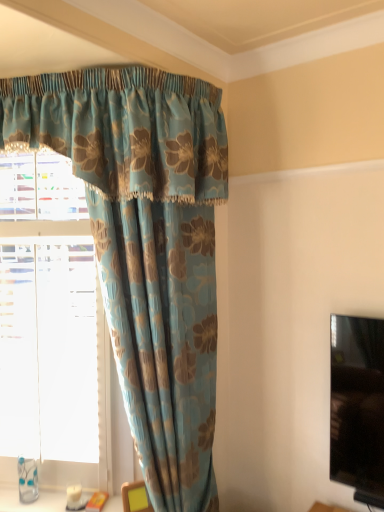
This screenshot has width=384, height=512. What do you see at coordinates (48, 349) in the screenshot? I see `blue floral curtain at upper left` at bounding box center [48, 349].

The height and width of the screenshot is (512, 384). What do you see at coordinates (135, 497) in the screenshot?
I see `yellow fabric at lower center` at bounding box center [135, 497].

Identify the location of blue floral curtain at upper left. This screenshot has width=384, height=512. (48, 349).

From the image's perspective, relative to blue floral curtain at upper left, is blue floral fabric curtain at upper left above or below?

blue floral fabric curtain at upper left is below blue floral curtain at upper left.

Which is behind, point (171, 301) or point (76, 190)?

The point (76, 190) is farther.

Are blue floral fabric curtain at upper left and blue floral curtain at upper left making contact?

No, blue floral fabric curtain at upper left is not making contact with blue floral curtain at upper left.

At what (x,y) coordinates should I click in order to perform the action: click on curtain on the right of the blue floral curtain at upper left. Please return your answer as a coordinate pair (x, y). The image size is (384, 512). Looking at the image, I should click on (146, 245).

Is blue floral fabric curtain at upper left to the left or to the right of yellow fabric at lower center in the image?

In the image, blue floral fabric curtain at upper left appears on the right side of yellow fabric at lower center.

Considering the sizes of objects blue floral fabric curtain at upper left and yellow fabric at lower center in the image provided, who is smaller, blue floral fabric curtain at upper left or yellow fabric at lower center?

yellow fabric at lower center.

Could you tell me if blue floral fabric curtain at upper left is turned towards yellow fabric at lower center?

Yes, blue floral fabric curtain at upper left is turned towards yellow fabric at lower center.

Which of these two, blue floral fabric curtain at upper left or yellow fabric at lower center, is wider?

blue floral fabric curtain at upper left.

From a real-world perspective, is blue floral curtain at upper left positioned under blue floral fabric curtain at upper left based on gravity?

No, from a real-world perspective, blue floral curtain at upper left is not under blue floral fabric curtain at upper left.

From the image's perspective, would you say blue floral curtain at upper left is shown under blue floral fabric curtain at upper left?

No, from the image's perspective, blue floral curtain at upper left is not beneath blue floral fabric curtain at upper left.

In terms of width, does blue floral curtain at upper left look wider or thinner when compared to blue floral fabric curtain at upper left?

Clearly, blue floral curtain at upper left has more width compared to blue floral fabric curtain at upper left.

Considering the relative positions of blue floral curtain at upper left and blue floral fabric curtain at upper left in the image provided, is blue floral curtain at upper left to the right of blue floral fabric curtain at upper left from the viewer's perspective?

Incorrect, blue floral curtain at upper left is not on the right side of blue floral fabric curtain at upper left.

Does yellow fabric at lower center have a lesser width compared to blue floral fabric curtain at upper left?

Indeed, yellow fabric at lower center has a lesser width compared to blue floral fabric curtain at upper left.

From a real-world perspective, relative to blue floral fabric curtain at upper left, is yellow fabric at lower center vertically above or below?

From a real-world perspective, yellow fabric at lower center is physically below blue floral fabric curtain at upper left.

Is yellow fabric at lower center to the right of blue floral fabric curtain at upper left from the viewer's perspective?

Incorrect, yellow fabric at lower center is not on the right side of blue floral fabric curtain at upper left.

What's the angular difference between yellow fabric at lower center and blue floral fabric curtain at upper left's facing directions?

yellow fabric at lower center and blue floral fabric curtain at upper left are facing 34.6 degrees away from each other.

Is the depth of yellow fabric at lower center greater than that of blue floral curtain at upper left?

That is True.

Is yellow fabric at lower center at the left side of blue floral curtain at upper left?

No, yellow fabric at lower center is not to the left of blue floral curtain at upper left.

Can you tell me how much yellow fabric at lower center and blue floral curtain at upper left differ in facing direction?

The angular difference between yellow fabric at lower center and blue floral curtain at upper left is 24.3 degrees.

Is yellow fabric at lower center at the back of blue floral curtain at upper left?

blue floral curtain at upper left is not turned away from yellow fabric at lower center.

Where is `furniture behind the blue floral curtain at upper left`? The width and height of the screenshot is (384, 512). furniture behind the blue floral curtain at upper left is located at coordinates (135, 497).

Is blue floral curtain at upper left wider than yellow fabric at lower center?

Indeed, blue floral curtain at upper left has a greater width compared to yellow fabric at lower center.

Locate an element on the screen. The height and width of the screenshot is (512, 384). bay window behind the blue floral fabric curtain at upper left is located at coordinates (48, 349).

This screenshot has width=384, height=512. In order to click on curtain in front of the yellow fabric at lower center in this screenshot , I will do [x=146, y=245].

Looking at the image, which one is located further to blue floral fabric curtain at upper left, blue floral curtain at upper left or yellow fabric at lower center?

yellow fabric at lower center.

When comparing their distances from yellow fabric at lower center, does blue floral curtain at upper left or blue floral fabric curtain at upper left seem further?

blue floral fabric curtain at upper left is further to yellow fabric at lower center.

Estimate the real-world distances between objects in this image. Which object is closer to blue floral fabric curtain at upper left, yellow fabric at lower center or blue floral curtain at upper left?

blue floral curtain at upper left is positioned closer to the anchor blue floral fabric curtain at upper left.

Looking at this image, which object lies further to the anchor point blue floral curtain at upper left, yellow fabric at lower center or blue floral fabric curtain at upper left?

yellow fabric at lower center is further to blue floral curtain at upper left.

Considering their positions, is blue floral fabric curtain at upper left positioned closer to yellow fabric at lower center than blue floral curtain at upper left?

Among the two, blue floral curtain at upper left is located nearer to yellow fabric at lower center.

Looking at the image, which one is located further to blue floral curtain at upper left, blue floral fabric curtain at upper left or yellow fabric at lower center?

The object further to blue floral curtain at upper left is yellow fabric at lower center.

At what (x,y) coordinates should I click in order to perform the action: click on curtain between blue floral curtain at upper left and yellow fabric at lower center from top to bottom. Please return your answer as a coordinate pair (x, y). Looking at the image, I should click on (146, 245).